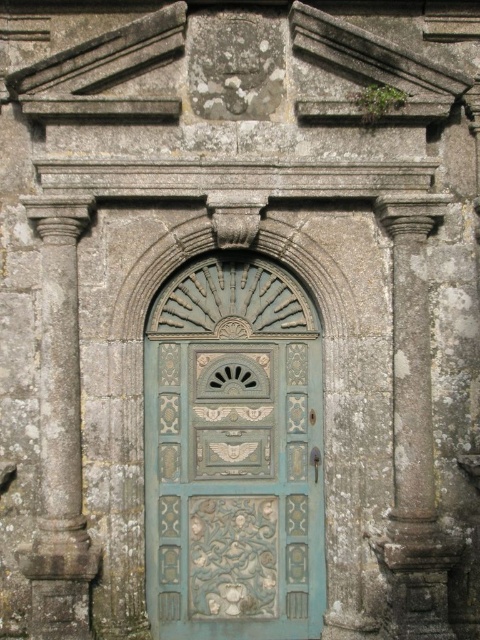
You are an architect examining the old stone building. You need to determine if the blue carved door at center can fit through the opening created by the gray stone column at right. Based on their sizes, can the door pass through the column opening?

The blue carved door at center has a smaller size compared to the gray stone column at right. Since the door is smaller, it can fit through the opening created by the gray stone column at right.